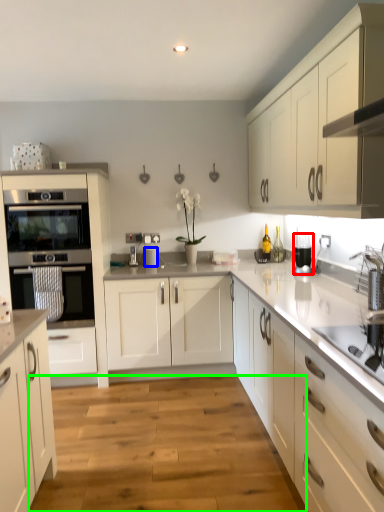
Question: Which object is positioned closest to kitchen appliance (highlighted by a red box)? Select from appliance (highlighted by a blue box) and plain (highlighted by a green box).

Choices:
 (A) appliance
 (B) plain

Answer: (A)